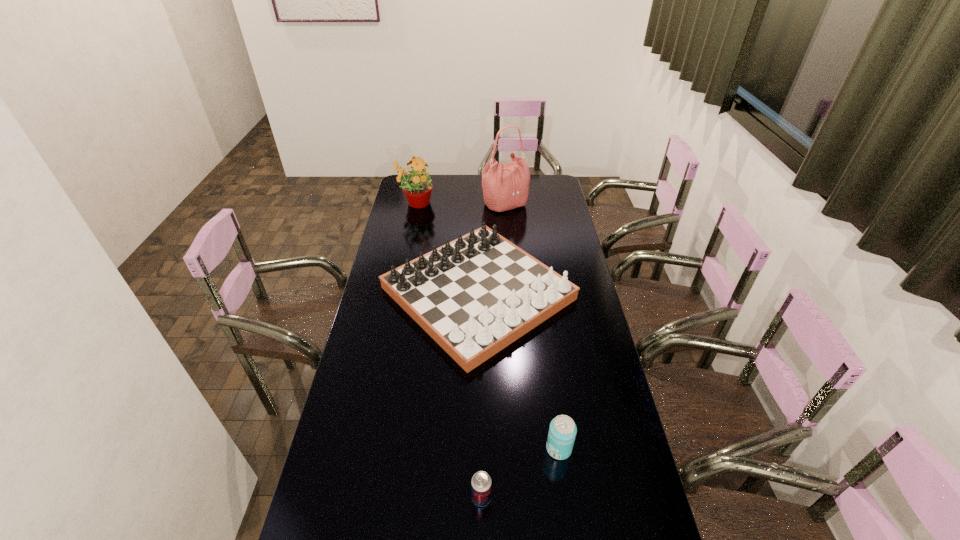
Where is `the tallest object`? the tallest object is located at coordinates (505, 186).

The height and width of the screenshot is (540, 960). In order to click on flowerpot in this screenshot , I will do `click(417, 187)`.

Locate an element on the screen. This screenshot has width=960, height=540. gameboard is located at coordinates (474, 296).

At what (x,y) coordinates should I click in order to perform the action: click on the third tallest object. Please return your answer as a coordinate pair (x, y). Looking at the image, I should click on (474, 296).

Locate an element on the screen. the second shortest object is located at coordinates (562, 431).

Identify the location of the right beer can. This screenshot has width=960, height=540. (562, 431).

Locate an element on the screen. The image size is (960, 540). the nearest object is located at coordinates (481, 482).

You are a GUI agent. You are given a task and a screenshot of the screen. Output one action in this format:
    pyautogui.click(x=<x>, y=<y>)
    Task: Click on the nearer beer can
    Image resolution: width=960 pixels, height=540 pixels.
    Given the screenshot: What is the action you would take?
    pyautogui.click(x=481, y=482)

The image size is (960, 540). What are the coordinates of `free point located 0.230m on the left of the handbag` in the screenshot? It's located at (437, 204).

At what (x,y) coordinates should I click in order to perform the action: click on vacant space located on the front of the flowerpot. Please return your answer as a coordinate pair (x, y). The width and height of the screenshot is (960, 540). Looking at the image, I should click on [411, 225].